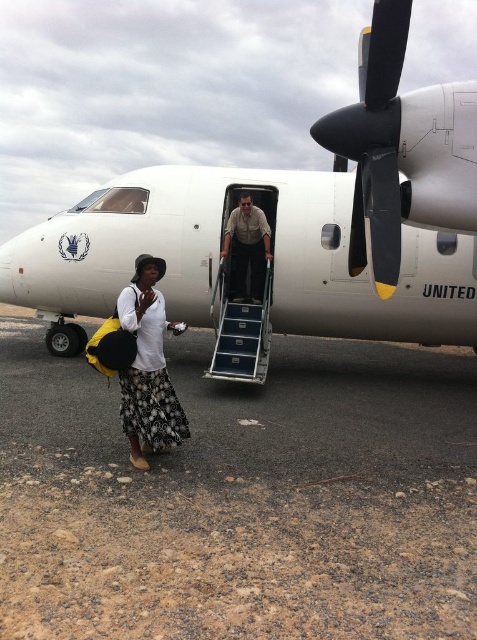
Is dirt ground at lower left further to the viewer compared to black matte propeller at upper right?

No, it is not.

Does dirt ground at lower left have a greater width compared to black matte propeller at upper right?

In fact, dirt ground at lower left might be narrower than black matte propeller at upper right.

Locate an element on the screen. dirt ground at lower left is located at coordinates (241, 499).

Is white cotton shirt at lower left wider than khaki uniform at center?

No.

Does point (124, 308) lie in front of point (244, 244)?

Yes, it is in front of point (244, 244).

Where is `white cotton shirt at lower left`? white cotton shirt at lower left is located at coordinates (147, 365).

Does white matte airplane at center have a lesser width compared to black matte propeller at upper right?

Incorrect, white matte airplane at center's width is not less than black matte propeller at upper right's.

Image resolution: width=477 pixels, height=640 pixels. What do you see at coordinates (290, 227) in the screenshot?
I see `white matte airplane at center` at bounding box center [290, 227].

The image size is (477, 640). I want to click on white matte airplane at center, so click(x=290, y=227).